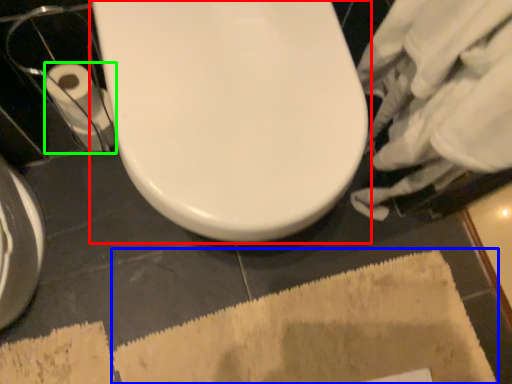
Question: Considering the real-world distances, which object is closest to toilet (highlighted by a red box)? bath mat (highlighted by a blue box) or toilet paper (highlighted by a green box).

Choices:
 (A) bath mat
 (B) toilet paper

Answer: (B)